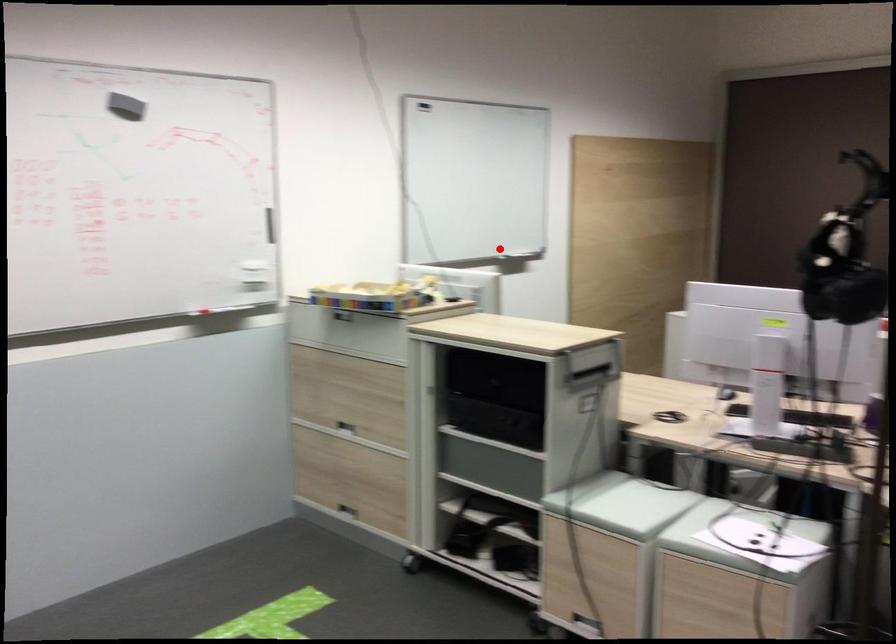
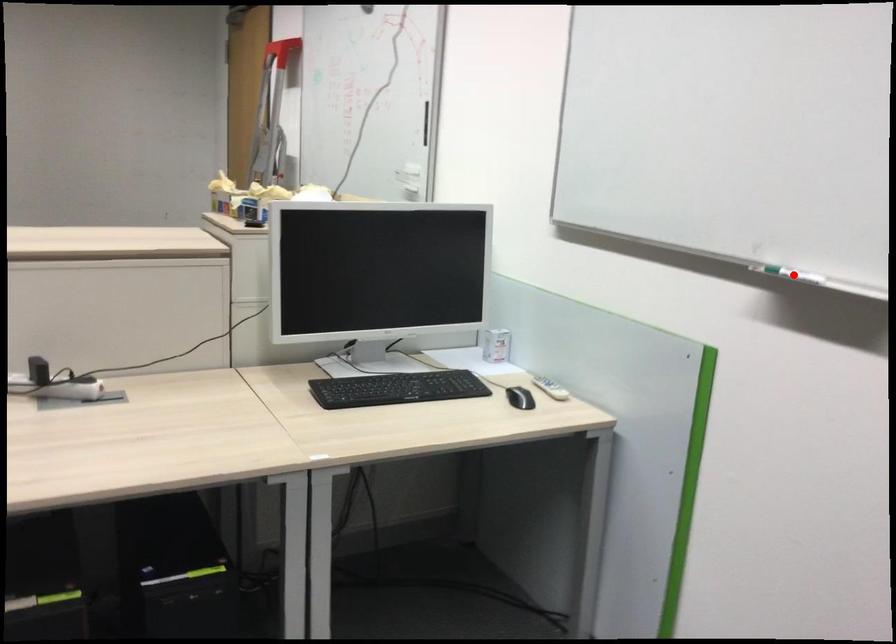
I am providing you with two images of the same scene from different viewpoints. A red point is marked on the first image and another point is marked on the second image. Is the marked point in image1 the same physical position as the marked point in image2?

Yes